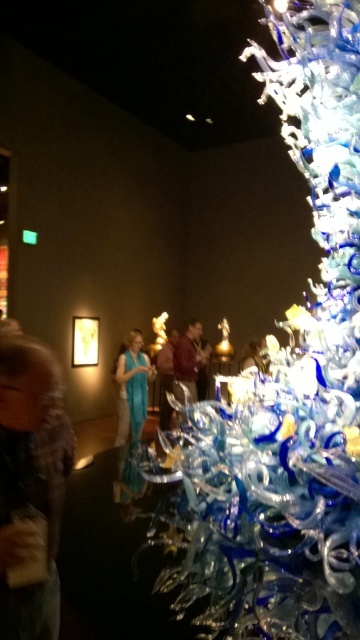
In the scene shown: You are standing in the art gallery and see two points marked in the image. Which point is closer to you, point [313,429] or point [20,611]?

Point [20,611] is closer to you because it is less further to the camera than point [313,429].

You are standing in the art gallery and want to take a photo of the glass sculpture. You notice two points marked in the scene. Which point is closer to you, point [232,410] or point [164,388]?

Point [232,410] is closer to the viewer than point [164,388].

You are standing in an art gallery and see the blue glass sculpture at right. If you want to touch it, will you be able to reach it without moving your feet?

The blue glass sculpture at right is 4.67 feet away from the viewer, which is approximately 56 inches. Since the average arm length is about 25 inches, you cannot reach it without moving your feet.